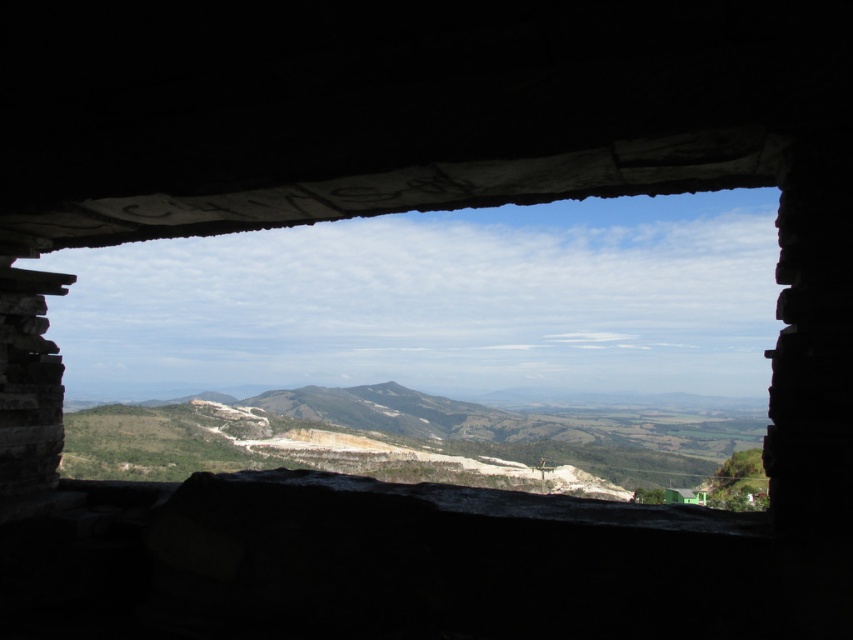
Question: Is stone window at center above green grassy mountain at center?

Choices:
 (A) no
 (B) yes

Answer: (B)

Question: Which point is farther from the camera taking this photo?

Choices:
 (A) (664, 237)
 (B) (341, 451)

Answer: (A)

Question: Can you confirm if stone window at center is positioned below green grassy mountain at center?

Choices:
 (A) yes
 (B) no

Answer: (B)

Question: Can you confirm if stone window at center is positioned to the right of green grassy mountain at center?

Choices:
 (A) yes
 (B) no

Answer: (B)

Question: Which object appears closest to the camera in this image?

Choices:
 (A) stone window at center
 (B) green grassy mountain at center

Answer: (A)

Question: Which of the following is the closest to the observer?

Choices:
 (A) (293, 400)
 (B) (291, 234)

Answer: (A)